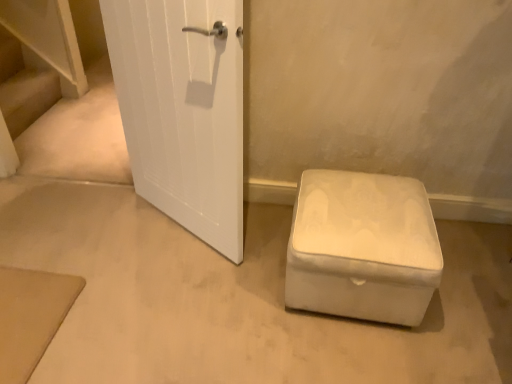
Question: Visually, is white fabric ottoman at lower right positioned to the left or to the right of wooden stairs at left?

Choices:
 (A) left
 (B) right

Answer: (B)

Question: Relative to wooden stairs at left, is white fabric ottoman at lower right in front or behind?

Choices:
 (A) front
 (B) behind

Answer: (A)

Question: Considering the positions of white fabric ottoman at lower right and wooden stairs at left in the image, is white fabric ottoman at lower right bigger or smaller than wooden stairs at left?

Choices:
 (A) small
 (B) big

Answer: (B)

Question: Considering the positions of wooden stairs at left and white fabric ottoman at lower right in the image, is wooden stairs at left wider or thinner than white fabric ottoman at lower right?

Choices:
 (A) thin
 (B) wide

Answer: (A)

Question: Is wooden stairs at left in front of or behind white fabric ottoman at lower right in the image?

Choices:
 (A) front
 (B) behind

Answer: (B)

Question: From the image's perspective, is wooden stairs at left positioned above or below white fabric ottoman at lower right?

Choices:
 (A) above
 (B) below

Answer: (A)

Question: Is wooden stairs at left bigger or smaller than white fabric ottoman at lower right?

Choices:
 (A) big
 (B) small

Answer: (B)